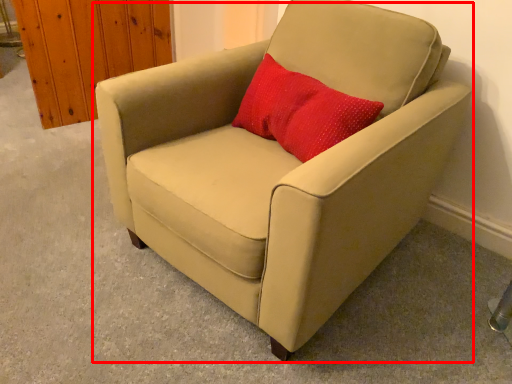
Question: From the image's perspective, what is the correct spatial positioning of chair (annotated by the red box) in reference to throw pillow?

Choices:
 (A) below
 (B) above

Answer: (A)